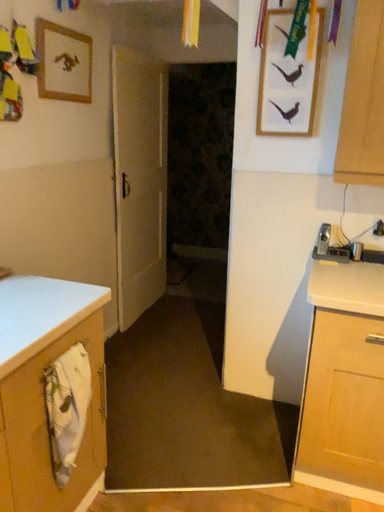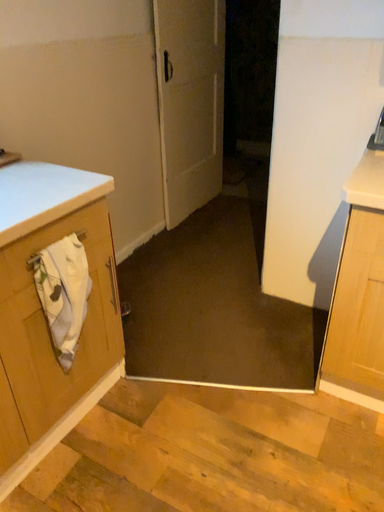
Question: Which way did the camera rotate in the video?

Choices:
 (A) rotated left
 (B) rotated right

Answer: (A)